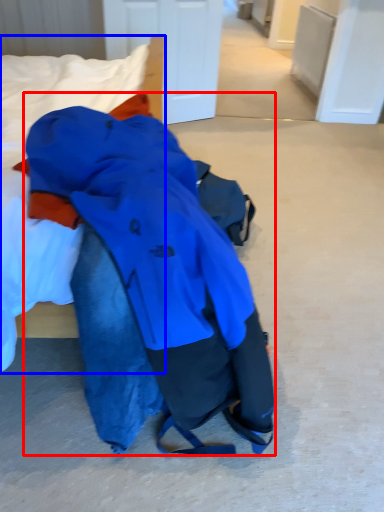
Question: Which point is closer to the camera, jacket (highlighted by a red box) or bed (highlighted by a blue box)?

Choices:
 (A) jacket
 (B) bed

Answer: (A)